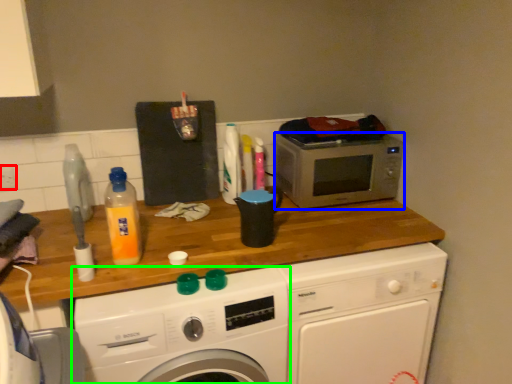
Question: Estimate the real-world distances between objects in this image. Which object is closer to power plugs and sockets (highlighted by a red box), microwave oven (highlighted by a blue box) or washing machine (highlighted by a green box)?

Choices:
 (A) microwave oven
 (B) washing machine

Answer: (B)